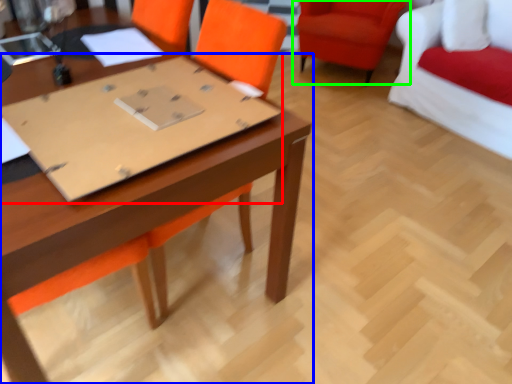
Question: Based on their relative distances, which object is farther from cardboard (highlighted by a red box)? Choose from table (highlighted by a blue box) and chair (highlighted by a green box).

Choices:
 (A) table
 (B) chair

Answer: (B)